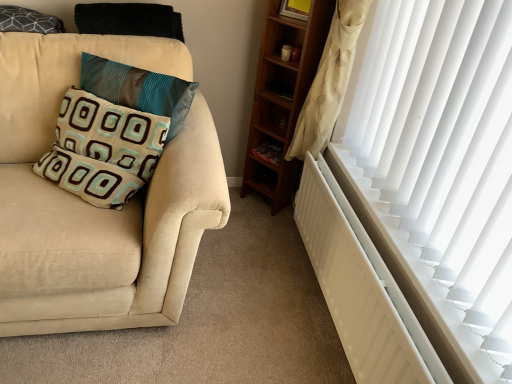
Question: From the image's perspective, relative to teal fabric pillow at left, which is the second pillow in top-to-bottom order, is beige fabric pillow at left, which is the first pillow in bottom-to-top order, above or below?

Choices:
 (A) above
 (B) below

Answer: (B)

Question: From a real-world perspective, is beige fabric pillow at left, which is the first pillow in bottom-to-top order, physically located above or below teal fabric pillow at left, the second pillow when ordered from bottom to top?

Choices:
 (A) below
 (B) above

Answer: (A)

Question: Which object is positioned farthest from the wooden bookshelf at center?

Choices:
 (A) dark gray textured pillow at upper left, which ranks as the first pillow in top-to-bottom order
 (B) teal fabric pillow at left, the second pillow when ordered from bottom to top
 (C) suede beige couch at left
 (D) beige fabric pillow at left, which is the first pillow in bottom-to-top order
 (E) white matte radiator at right

Answer: (A)

Question: Which object is positioned closest to the beige fabric pillow at left, which is the first pillow in bottom-to-top order?

Choices:
 (A) white matte radiator at right
 (B) dark gray textured pillow at upper left, the 3th pillow when ordered from bottom to top
 (C) teal fabric pillow at left, which is the second pillow in top-to-bottom order
 (D) wooden bookshelf at center
 (E) suede beige couch at left

Answer: (C)